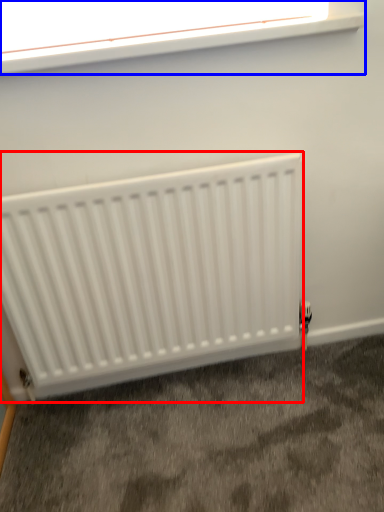
Question: Which object appears farthest to the camera in this image, radiator (highlighted by a red box) or window (highlighted by a blue box)?

Choices:
 (A) radiator
 (B) window

Answer: (A)